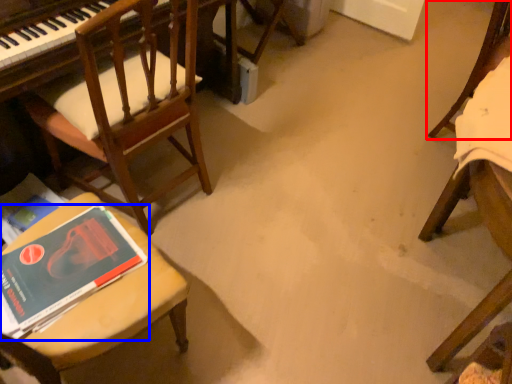
Question: Which object appears closest to the camera in this image, chair (highlighted by a red box) or book (highlighted by a blue box)?

Choices:
 (A) chair
 (B) book

Answer: (B)